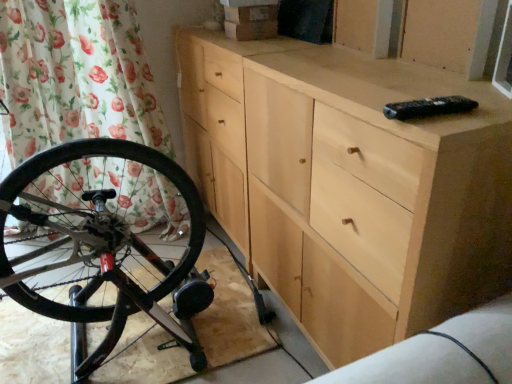
Question: In terms of size, does floral fabric curtain at left appear bigger or smaller than natural wood chest of drawers at center?

Choices:
 (A) small
 (B) big

Answer: (A)

Question: Is floral fabric curtain at left situated inside natural wood chest of drawers at center or outside?

Choices:
 (A) outside
 (B) inside

Answer: (A)

Question: Based on their relative distances, which object is nearer to the floral fabric curtain at left?

Choices:
 (A) natural wood chest of drawers at center
 (B) clear glass window screen at upper right

Answer: (A)

Question: Which object is positioned closest to the floral fabric curtain at left?

Choices:
 (A) natural wood chest of drawers at center
 (B) clear glass window screen at upper right

Answer: (A)